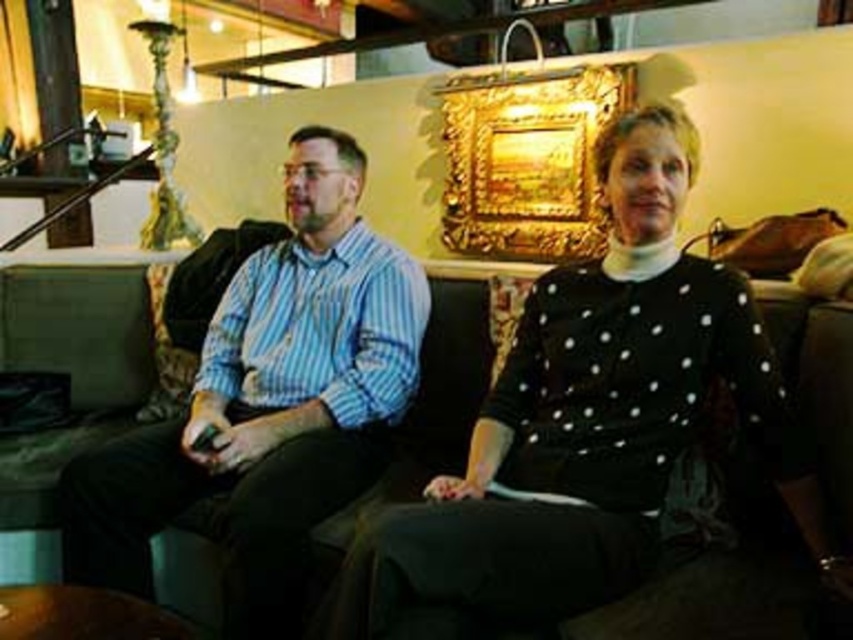
Can you confirm if black dotted sweater at center is taller than blue striped shirt at left?

In fact, black dotted sweater at center may be shorter than blue striped shirt at left.

Between point (421, 541) and point (352, 396), which one is positioned in front?

Point (421, 541) is in front.

The image size is (853, 640). What do you see at coordinates (590, 419) in the screenshot? I see `black dotted sweater at center` at bounding box center [590, 419].

Where is `black dotted sweater at center`? black dotted sweater at center is located at coordinates (590, 419).

Can you confirm if black dotted sweater at center is thinner than black leather couch at center?

No.

Is black dotted sweater at center shorter than black leather couch at center?

No.

Does point (727, 372) lie in front of point (380, 492)?

That is True.

Identify the location of black dotted sweater at center. This screenshot has height=640, width=853. (590, 419).

Which is more to the left, blue striped shirt at left or black leather couch at center?

From the viewer's perspective, blue striped shirt at left appears more on the left side.

Find the location of a particular element. This screenshot has width=853, height=640. blue striped shirt at left is located at coordinates (268, 403).